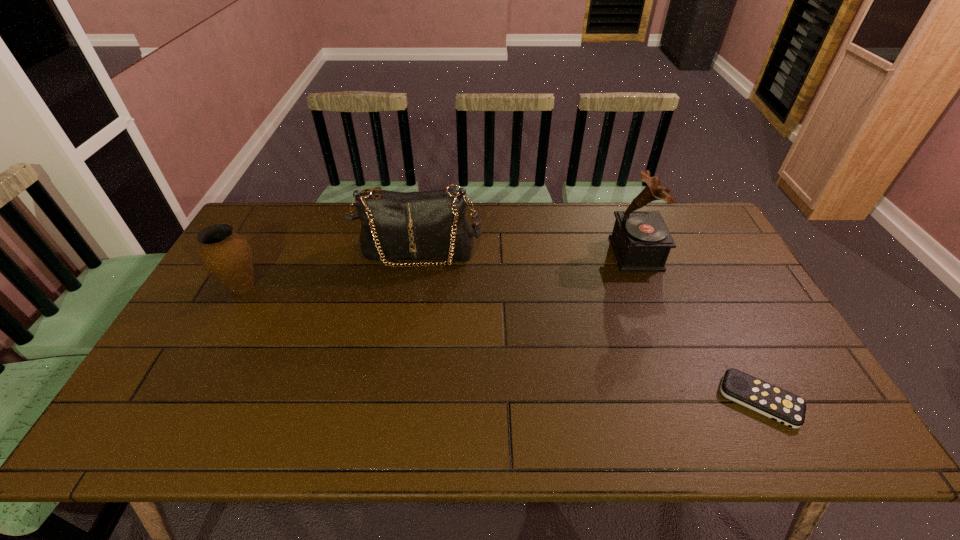
I want to click on vacant position at the right edge of the desktop, so coord(739,325).

Locate an element on the screen. The image size is (960, 540). vacant space at the far right corner of the desktop is located at coordinates (678, 231).

Where is `vacant space that is in between the third object from right to left and the shortest object`? This screenshot has height=540, width=960. vacant space that is in between the third object from right to left and the shortest object is located at coordinates (589, 326).

At what (x,y) coordinates should I click in order to perform the action: click on empty space that is in between the third object from right to left and the leftmost object. Please return your answer as a coordinate pair (x, y). This screenshot has width=960, height=540. Looking at the image, I should click on (330, 270).

Locate an element on the screen. The height and width of the screenshot is (540, 960). free space between the handbag and the shortest object is located at coordinates (589, 326).

The width and height of the screenshot is (960, 540). I want to click on vacant region between the phonograph_record and the urn, so click(440, 271).

I want to click on free space between the leftmost object and the handbag, so click(330, 270).

Find the location of a particular element. Image resolution: width=960 pixels, height=540 pixels. free space that is in between the phonograph_record and the shortest object is located at coordinates (698, 327).

Where is `vacant area that lies between the phonograph_record and the urn`? Image resolution: width=960 pixels, height=540 pixels. vacant area that lies between the phonograph_record and the urn is located at coordinates (440, 271).

Where is `vacant point located between the phonograph_record and the handbag`? vacant point located between the phonograph_record and the handbag is located at coordinates (527, 253).